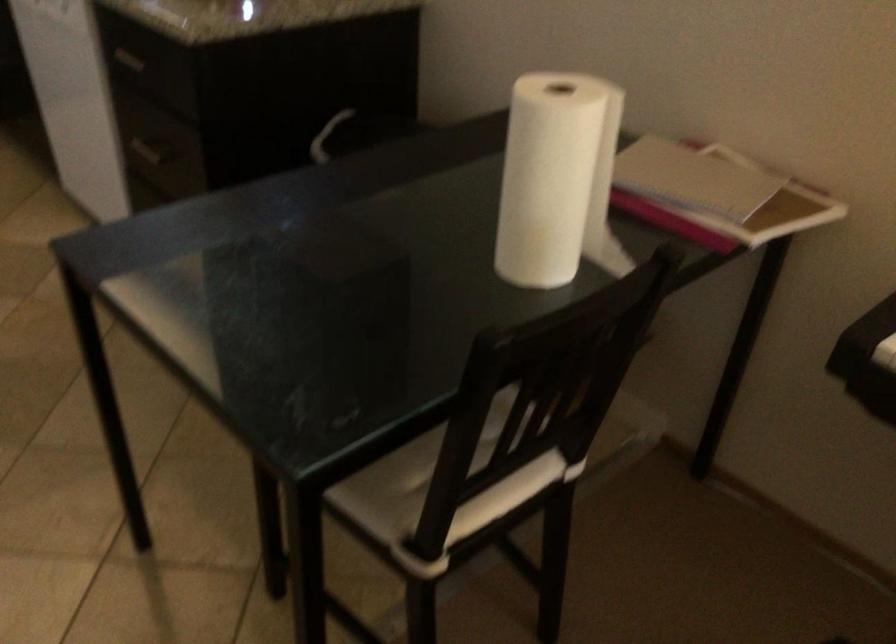
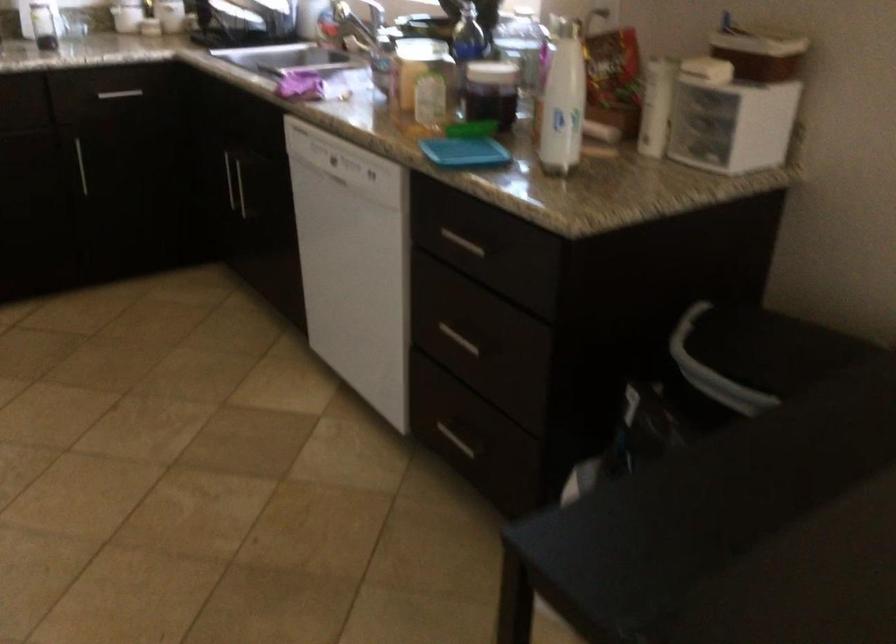
The point at (151, 156) is marked in the first image. Where is the corresponding point in the second image?

(459, 339)